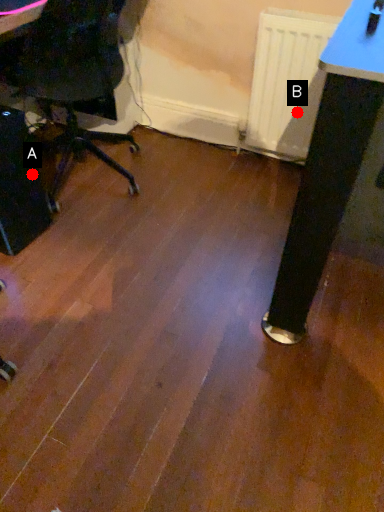
Question: Two points are circled on the image, labeled by A and B beside each circle. Which point appears closest to the camera in this image?

Choices:
 (A) A is closer
 (B) B is closer

Answer: (A)